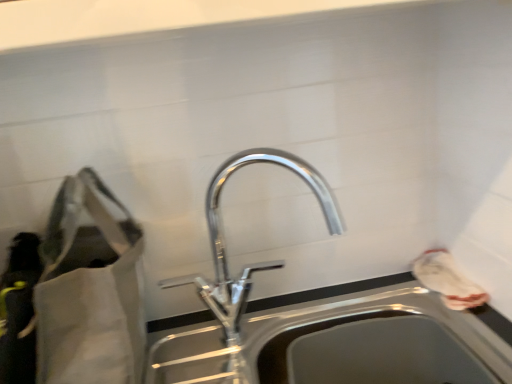
Question: Considering the relative positions of stainless steel sink at center and white fabric bag at right, arranged as the 2th bag when viewed from the left, in the image provided, is stainless steel sink at center to the left of white fabric bag at right, arranged as the 2th bag when viewed from the left, from the viewer's perspective?

Choices:
 (A) yes
 (B) no

Answer: (A)

Question: Considering the relative sizes of stainless steel sink at center and white fabric bag at right, the 1th bag positioned from the right, in the image provided, is stainless steel sink at center shorter than white fabric bag at right, the 1th bag positioned from the right,?

Choices:
 (A) yes
 (B) no

Answer: (B)

Question: Does stainless steel sink at center turn towards white fabric bag at right, arranged as the 2th bag when viewed from the left?

Choices:
 (A) yes
 (B) no

Answer: (B)

Question: Is stainless steel sink at center taller than white fabric bag at right, arranged as the 2th bag when viewed from the left?

Choices:
 (A) yes
 (B) no

Answer: (A)

Question: Considering the relative positions of stainless steel sink at center and white fabric bag at right, arranged as the 2th bag when viewed from the left, in the image provided, is stainless steel sink at center in front of white fabric bag at right, arranged as the 2th bag when viewed from the left,?

Choices:
 (A) yes
 (B) no

Answer: (A)

Question: Does stainless steel sink at center have a greater width compared to white fabric bag at right, the 1th bag positioned from the right?

Choices:
 (A) no
 (B) yes

Answer: (B)

Question: Is white fabric bag at right, the 1th bag positioned from the right, to the right of matte gray bag at left, positioned as the first bag in left-to-right order, from the viewer's perspective?

Choices:
 (A) no
 (B) yes

Answer: (B)

Question: From a real-world perspective, is white fabric bag at right, the 1th bag positioned from the right, physically below matte gray bag at left, positioned as the first bag in left-to-right order?

Choices:
 (A) yes
 (B) no

Answer: (A)

Question: Is white fabric bag at right, arranged as the 2th bag when viewed from the left, taller than matte gray bag at left, positioned as the 2th bag in right-to-left order?

Choices:
 (A) yes
 (B) no

Answer: (B)

Question: Can you confirm if white fabric bag at right, the 1th bag positioned from the right, is wider than matte gray bag at left, positioned as the 2th bag in right-to-left order?

Choices:
 (A) no
 (B) yes

Answer: (A)

Question: Does white fabric bag at right, the 1th bag positioned from the right, have a larger size compared to matte gray bag at left, positioned as the first bag in left-to-right order?

Choices:
 (A) yes
 (B) no

Answer: (B)

Question: Is matte gray bag at left, positioned as the 2th bag in right-to-left order, smaller than stainless steel sink at center?

Choices:
 (A) no
 (B) yes

Answer: (A)